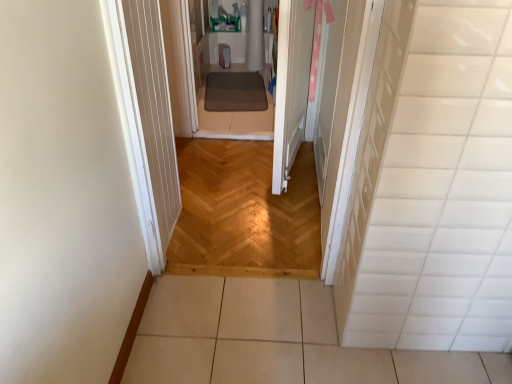
Question: Is white wood door at center at the right side of white glossy tile at right?

Choices:
 (A) no
 (B) yes

Answer: (A)

Question: Is white wood door at center shorter than white glossy tile at right?

Choices:
 (A) no
 (B) yes

Answer: (B)

Question: From a real-world perspective, is white wood door at center located higher than white glossy tile at right?

Choices:
 (A) yes
 (B) no

Answer: (B)

Question: From a real-world perspective, is white wood door at center positioned under white glossy tile at right based on gravity?

Choices:
 (A) yes
 (B) no

Answer: (A)

Question: Are white wood door at center and white glossy tile at right making contact?

Choices:
 (A) yes
 (B) no

Answer: (B)

Question: Is white wood door at center positioned in front of white glossy tile at right?

Choices:
 (A) no
 (B) yes

Answer: (A)

Question: Could white wood door at center be considered to be inside white tile floor at lower center?

Choices:
 (A) no
 (B) yes

Answer: (A)

Question: Is white tile floor at lower center to the left of white wood door at center from the viewer's perspective?

Choices:
 (A) no
 (B) yes

Answer: (A)

Question: Is white tile floor at lower center oriented towards white wood door at center?

Choices:
 (A) yes
 (B) no

Answer: (B)

Question: From a real-world perspective, does white tile floor at lower center sit lower than white wood door at center?

Choices:
 (A) no
 (B) yes

Answer: (B)

Question: Can you confirm if white tile floor at lower center is positioned to the right of white wood door at center?

Choices:
 (A) yes
 (B) no

Answer: (A)

Question: Is white tile floor at lower center smaller than white wood door at center?

Choices:
 (A) no
 (B) yes

Answer: (B)

Question: Is white wood door at center in front of natural wood floor at center?

Choices:
 (A) yes
 (B) no

Answer: (A)